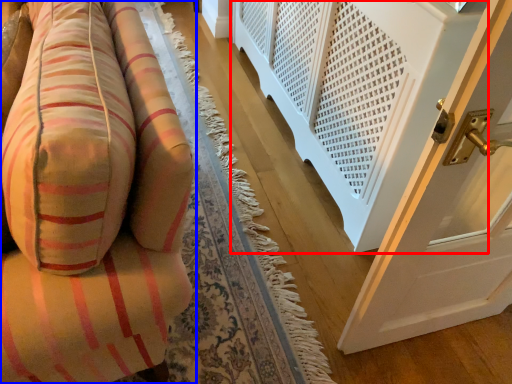
Question: Which of the following is the closest to the observer, balustrade (highlighted by a red box) or furniture (highlighted by a blue box)?

Choices:
 (A) balustrade
 (B) furniture

Answer: (B)